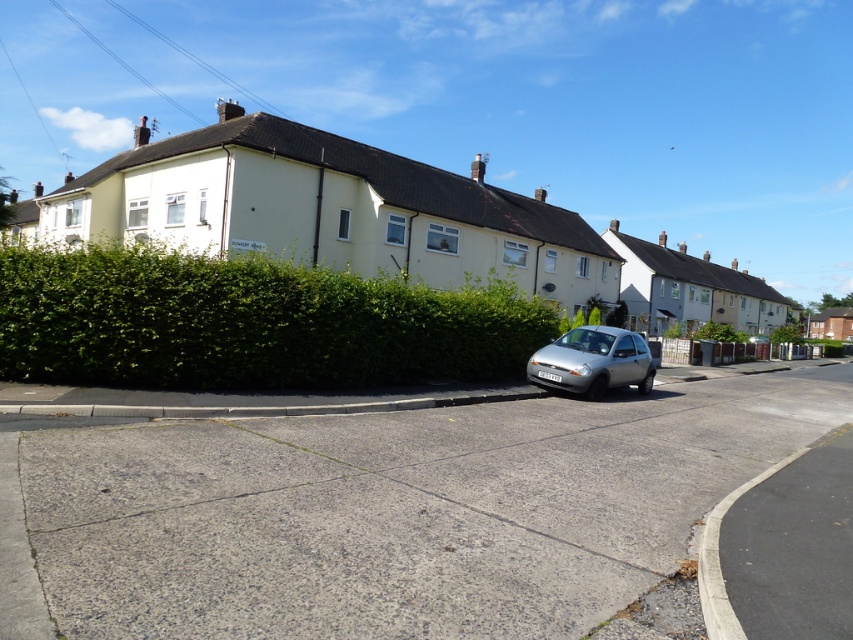
Question: Can you confirm if green leafy hedge at center is positioned to the left of silver metallic hatchback at center?

Choices:
 (A) yes
 (B) no

Answer: (A)

Question: Which point is farther from the camera taking this photo?

Choices:
 (A) (627, 349)
 (B) (354, 323)

Answer: (A)

Question: Does green leafy hedge at center have a lesser width compared to silver metallic hatchback at center?

Choices:
 (A) no
 (B) yes

Answer: (A)

Question: Which point is farther to the camera?

Choices:
 (A) (158, 253)
 (B) (634, 346)

Answer: (B)

Question: Does green leafy hedge at center appear over silver metallic hatchback at center?

Choices:
 (A) no
 (B) yes

Answer: (B)